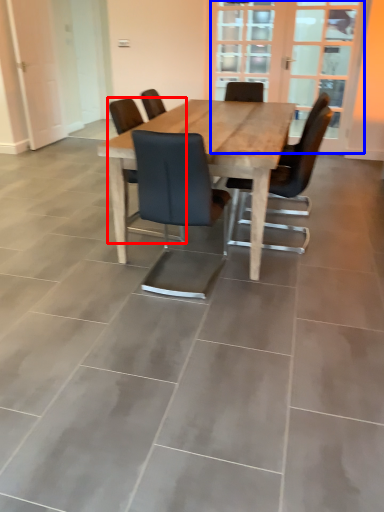
Question: Among these objects, which one is nearest to the camera, chair (highlighted by a red box) or screen door (highlighted by a blue box)?

Choices:
 (A) chair
 (B) screen door

Answer: (A)